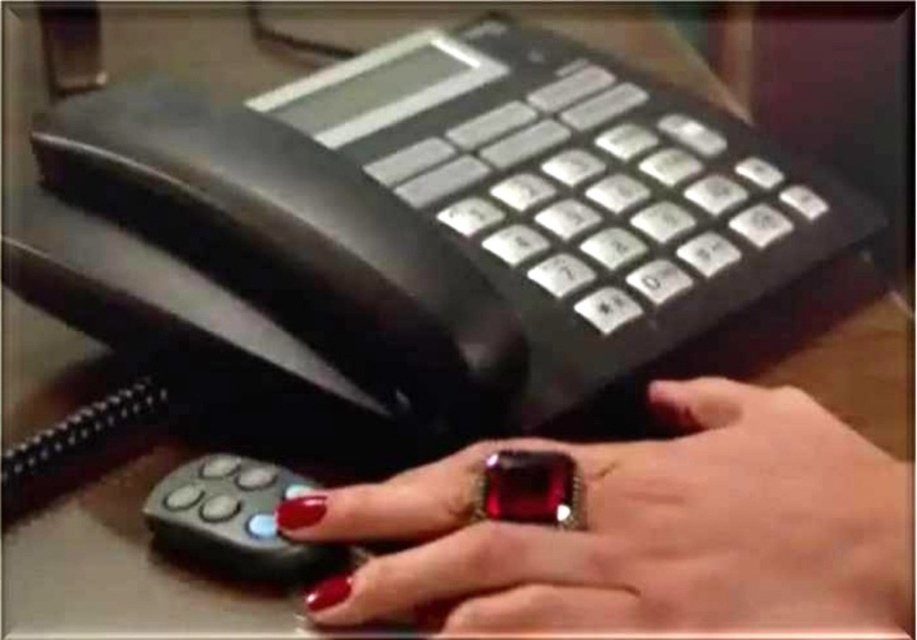
You are a person trying to reach the point marked at coordinates (643, 529) on the image. The scene shows a desk with a black office phone and a hand with a red nail polish and a ring. Can you tell me which object is located at that point?

The point marked at coordinates (643, 529) is on shiny red nail polish at center.

You are a delivery robot trying to place a package on the desk. The package is 4 inches wide. Is there enough space between the shiny red nail polish at center and the black rubber remote at lower left to fit the package?

The distance between the shiny red nail polish at center and the black rubber remote at lower left is 3.79 inches. Since the package is 4 inches wide, it is slightly wider than the available space, so it won

You are a customer service representative who needs to reach a client. You see the shiny red nail polish at center and the black rubber remote at lower left on your desk. Which object should you use to make a call?

You should use the black rubber remote at lower left to make a call because the shiny red nail polish at center is positioned over it and likely covering it, making it inaccessible.